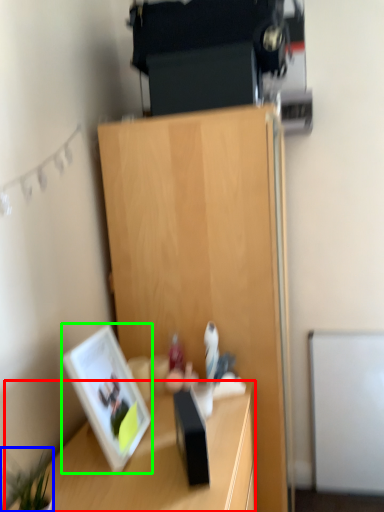
Question: Which object is positioned closest to desk (highlighted by a red box)? Select from plant (highlighted by a blue box) and picture frame (highlighted by a green box).

Choices:
 (A) plant
 (B) picture frame

Answer: (B)